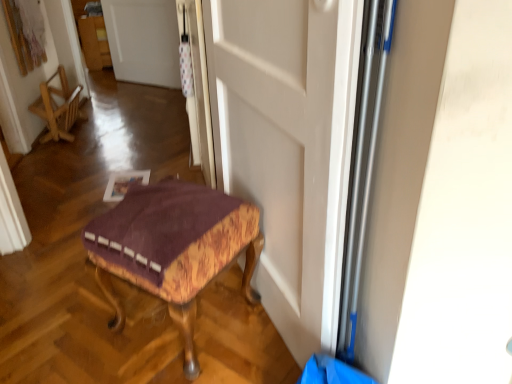
Question: Is velvet purple cushioned stool at lower center to the left or to the right of white glossy door at upper center, which is the second door in front-to-back order, in the image?

Choices:
 (A) left
 (B) right

Answer: (B)

Question: From the image's perspective, is velvet purple cushioned stool at lower center located above or below white glossy door at upper center, positioned as the first door in back-to-front order?

Choices:
 (A) above
 (B) below

Answer: (B)

Question: Considering the real-world distances, which object is closest to the wooden chair at left?

Choices:
 (A) velvet purple cushioned stool at lower center
 (B) white glossy door at upper center, which ranks as the first door in left-to-right order
 (C) white matte door at center, the first door from the right

Answer: (B)

Question: Estimate the real-world distances between objects in this image. Which object is closer to the white matte door at center, the second door when ordered from top to bottom?

Choices:
 (A) wooden chair at left
 (B) velvet purple cushioned stool at lower center
 (C) white glossy door at upper center, arranged as the 2th door when viewed from the right

Answer: (B)